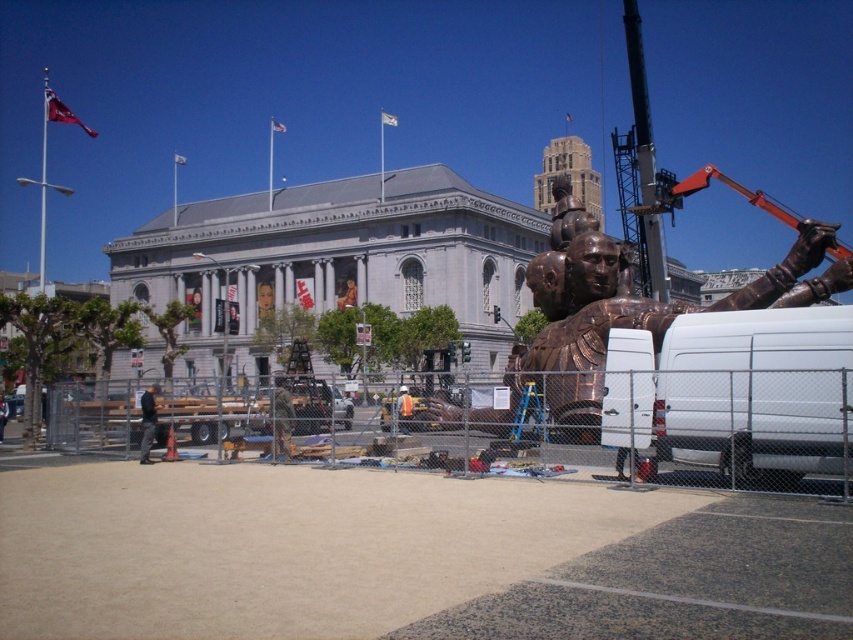
You are a construction worker who needs to ensure safety distances between the copper metallic statue at right and the black fabric jacket at center. According to safety regulations, the statue must be at least 1.5 meters taller than any nearby objects. Is this requirement met?

The copper metallic statue at right has a greater height compared to the black fabric jacket at center. Since the statue is taller than the jacket, and the requirement is that it must be at least 1.5 meters taller, but the description only states it is greater in height without specifying the exact difference, we cannot confirm if the 1.5 meter requirement is met without additional information.

You are a delivery driver who just arrived at the scene. You need to unload a package from your truck and deliver it to the construction crew working on the copper metallic statue at right. Where should you go to find the crew?

The construction crew working on the copper metallic statue at right can be found near the statue, which is located at point (630,305). The crew is likely near the base of the statue where tools and materials are scattered.

You are a delivery person who needs to deliver a package to the construction workers near the copper metallic statue at right and the black fabric jacket at center. Which object should you approach first if you want to reach the statue before the jacket?

You should approach the copper metallic statue at right first because it is located to the right of the black fabric jacket at center, meaning it is farther to the right side of the scene. However, since you want to reach the statue before the jacket, you might need to adjust your path, but based on their positions, the statue is already positioned to the right of the jacket, so approaching the statue directly would mean you arrive at it before the jacket if moving from the left side.